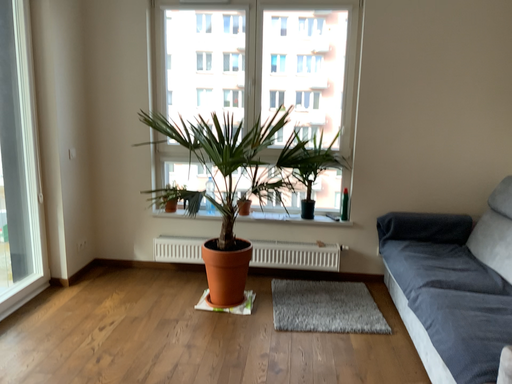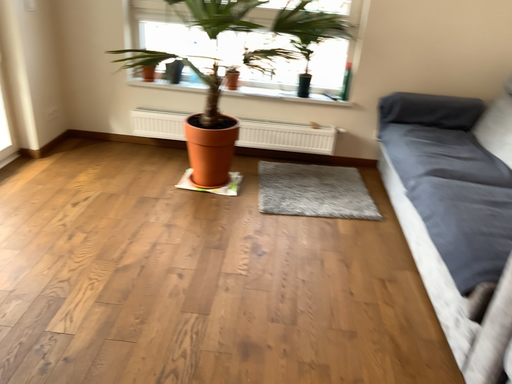
Question: How did the camera likely rotate when shooting the video?

Choices:
 (A) rotated upward
 (B) rotated downward

Answer: (B)